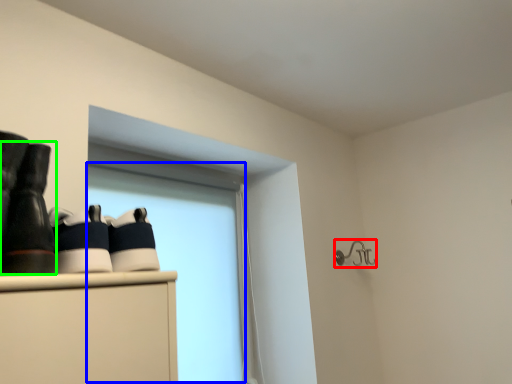
Question: Which object is positioned farthest from shower (highlighted by a red box)? Select from window screen (highlighted by a blue box) and footwear (highlighted by a green box).

Choices:
 (A) window screen
 (B) footwear

Answer: (B)